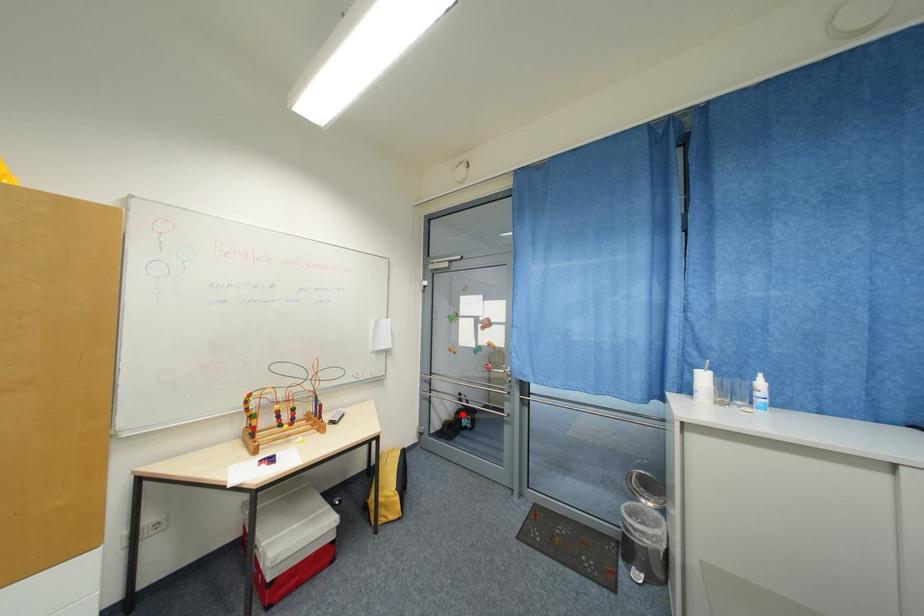
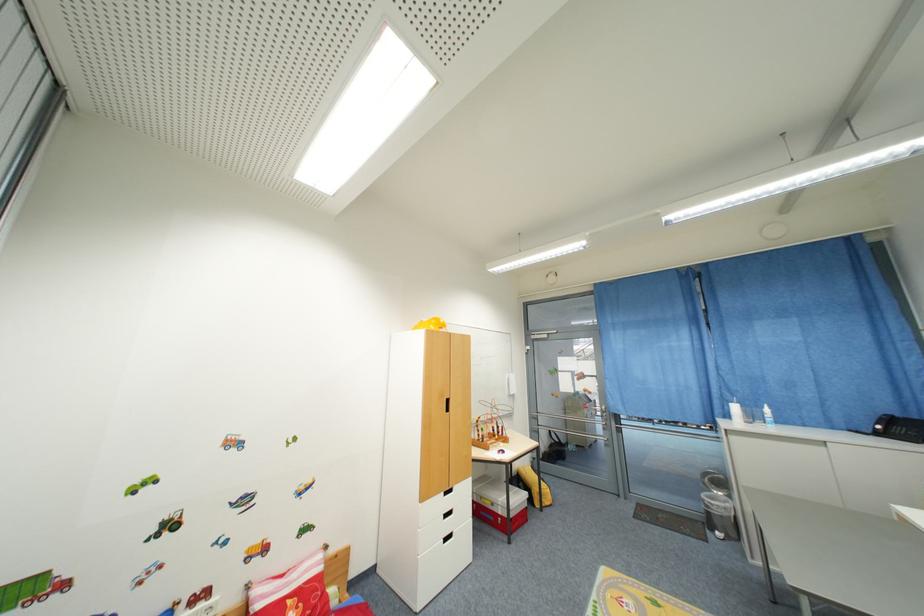
Question: A red point is marked in image1. In image2, is the corresponding 3D point closer to the camera or farther? Reply with the corresponding letter.

Choices:
 (A) The corresponding 3D point is closer.
 (B) The corresponding 3D point is farther.

Answer: (B)